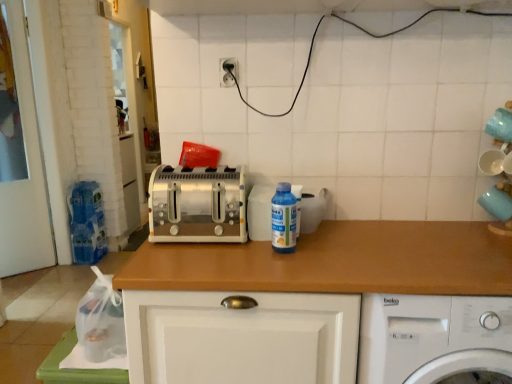
Question: Is transparent plastic bottle at center wider or thinner than wooden at center?

Choices:
 (A) wide
 (B) thin

Answer: (B)

Question: From the image's perspective, is transparent plastic bottle at center located above or below wooden at center?

Choices:
 (A) below
 (B) above

Answer: (B)

Question: Based on their relative distances, which object is farther from the wooden at center?

Choices:
 (A) satin silver toaster at center
 (B) white plastic washing machine at lower right
 (C) white plastic electric outlet at upper center
 (D) transparent plastic bottle at center

Answer: (C)

Question: Estimate the real-world distances between objects in this image. Which object is farther from the wooden at center?

Choices:
 (A) white plastic washing machine at lower right
 (B) white plastic electric outlet at upper center
 (C) transparent plastic bottle at center
 (D) satin silver toaster at center

Answer: (B)